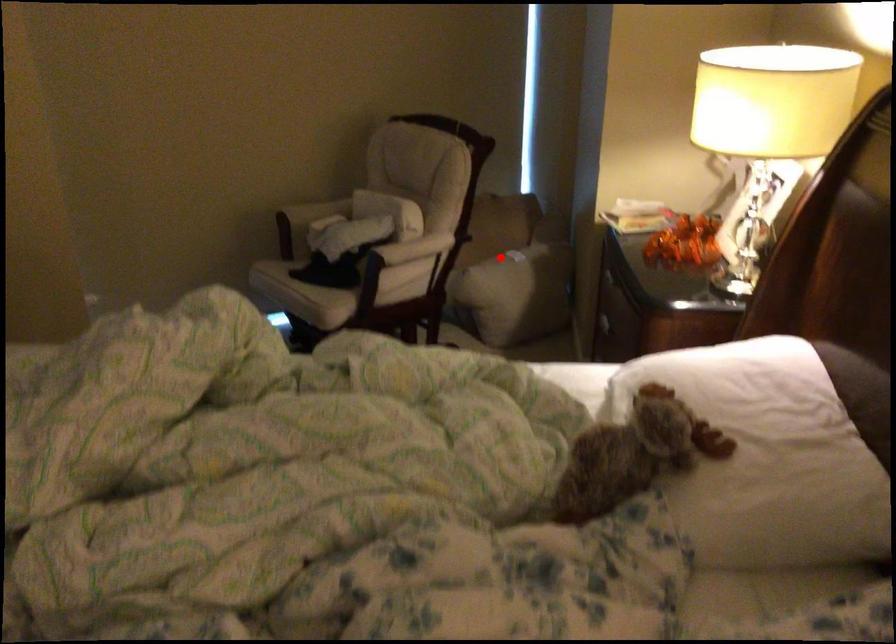
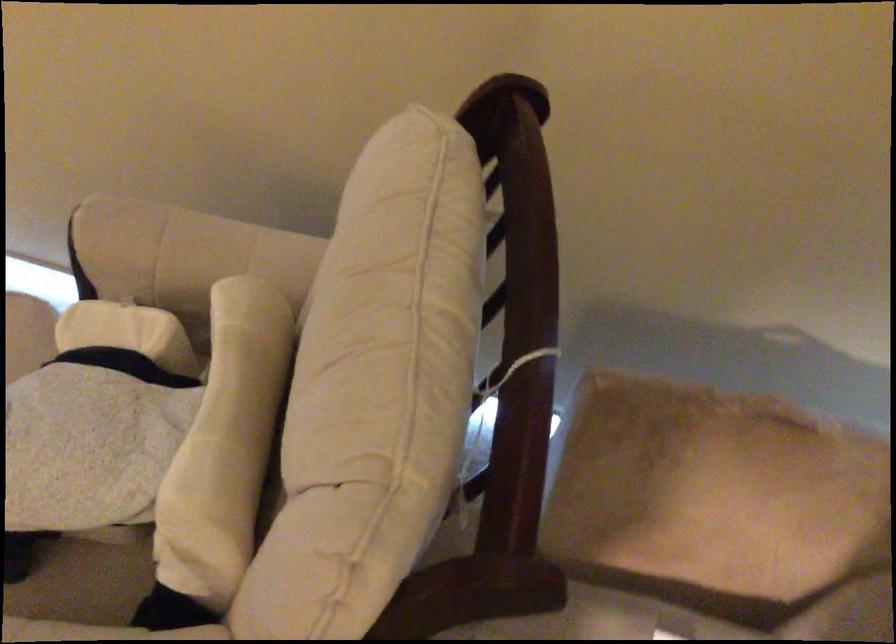
Question: I am providing you with two images of the same scene from different viewpoints. Image1 has a red point marked. In image2, the corresponding 3D location appears at what relative position? Reply with the corresponding letter.

Choices:
 (A) Closer
 (B) Farther

Answer: (A)